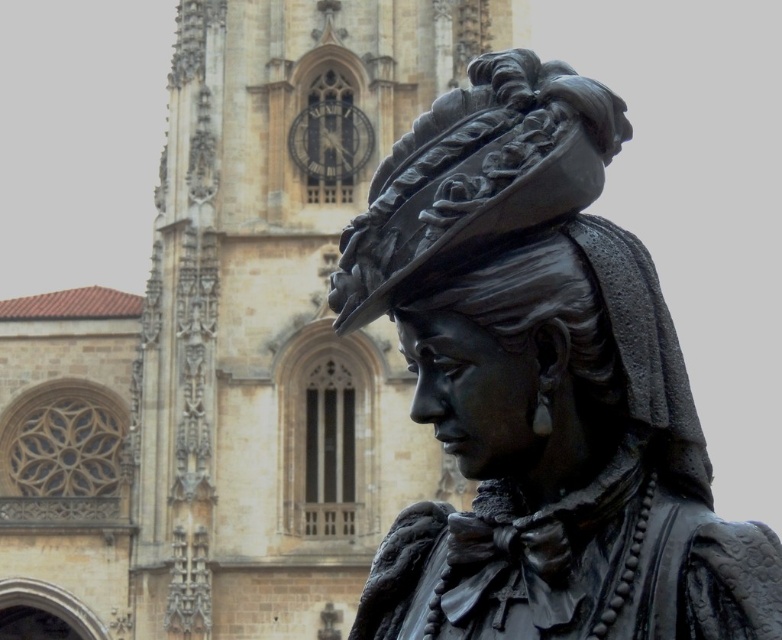
You are standing in front of the bronze statue of a woman facing left, which has intricate details on her clothing and accessories. You notice two points marked on the statue. The first point is at coordinate point (336, 547) and the second is at point (522, 371). If you want to touch the point that is closer to your face without moving your head, which point should you choose?

You should choose point (336, 547) because it is further to the camera than point (522, 371), making it closer to your face.

You are an art student analyzing the image. You need to determine which object, the beige stone church at center or the black polished statue at center, would cast a longer shadow during midday. Based on the scene description, which one would it be?

The beige stone church at center is larger in size than the black polished statue at center, so it would cast a longer shadow during midday.

You are a tourist standing in front of the bronze statue of a woman. You want to take a photo that includes both the black polished statue at center and the beige stone church at center. Based on their heights, which one should you focus on first to ensure both are in the frame?

The beige stone church at center is taller than the black polished statue at center. To include both in the frame, focus on the beige stone church at center first as it requires a wider angle to capture its height, then adjust to include the statue.